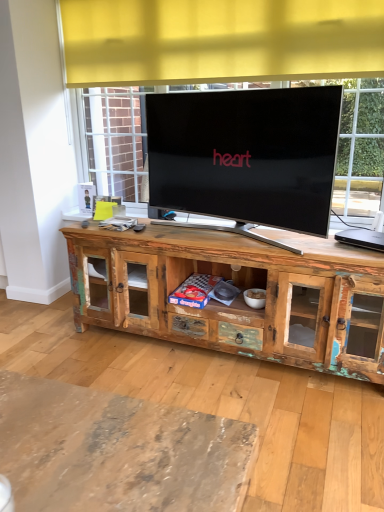
Question: Considering the relative sizes of rustic wood cabinet at center and black plastic laptop at right in the image provided, is rustic wood cabinet at center smaller than black plastic laptop at right?

Choices:
 (A) yes
 (B) no

Answer: (B)

Question: Can you confirm if rustic wood cabinet at center is positioned to the right of black plastic laptop at right?

Choices:
 (A) no
 (B) yes

Answer: (A)

Question: Is rustic wood cabinet at center further to camera compared to black plastic laptop at right?

Choices:
 (A) no
 (B) yes

Answer: (A)

Question: From the image's perspective, is rustic wood cabinet at center on top of black plastic laptop at right?

Choices:
 (A) yes
 (B) no

Answer: (B)

Question: Considering the relative sizes of rustic wood cabinet at center and black plastic laptop at right in the image provided, is rustic wood cabinet at center shorter than black plastic laptop at right?

Choices:
 (A) no
 (B) yes

Answer: (A)

Question: Considering the relative sizes of rustic wood cabinet at center and black plastic laptop at right in the image provided, is rustic wood cabinet at center bigger than black plastic laptop at right?

Choices:
 (A) yes
 (B) no

Answer: (A)

Question: Does black plastic laptop at right come behind rustic wood cabinet at center?

Choices:
 (A) no
 (B) yes

Answer: (B)

Question: From a real-world perspective, is black plastic laptop at right beneath rustic wood cabinet at center?

Choices:
 (A) no
 (B) yes

Answer: (A)

Question: Considering the relative sizes of black plastic laptop at right and rustic wood cabinet at center in the image provided, is black plastic laptop at right smaller than rustic wood cabinet at center?

Choices:
 (A) no
 (B) yes

Answer: (B)

Question: Does black plastic laptop at right have a lesser width compared to rustic wood cabinet at center?

Choices:
 (A) no
 (B) yes

Answer: (B)

Question: Does black plastic laptop at right appear on the right side of rustic wood cabinet at center?

Choices:
 (A) yes
 (B) no

Answer: (A)

Question: Does black plastic laptop at right appear on the left side of rustic wood cabinet at center?

Choices:
 (A) no
 (B) yes

Answer: (A)

Question: Considering the positions of rustic wood cabinet at center and black plastic laptop at right in the image, is rustic wood cabinet at center bigger or smaller than black plastic laptop at right?

Choices:
 (A) small
 (B) big

Answer: (B)